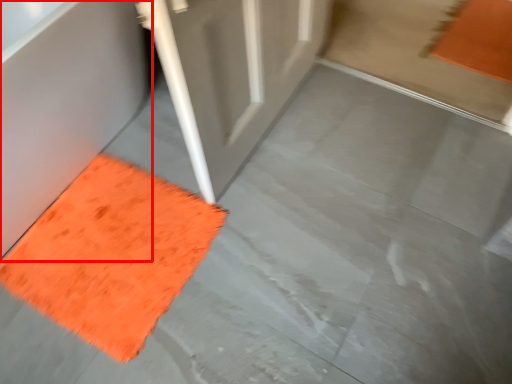
Question: From the image's perspective, where is bath (annotated by the red box) located relative to mat?

Choices:
 (A) below
 (B) above

Answer: (B)